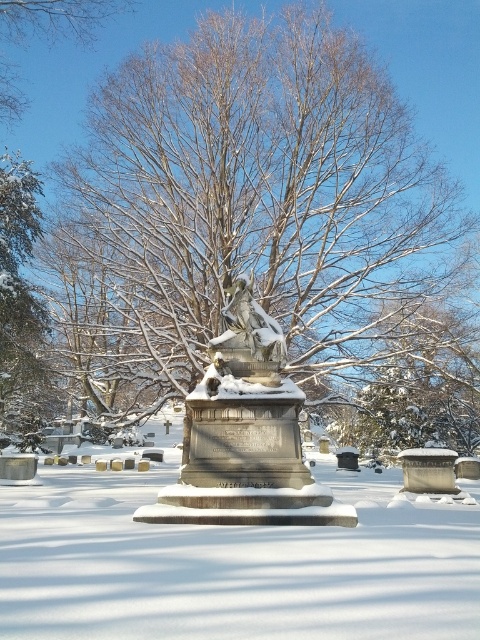
Question: Which object appears farthest from the camera in this image?

Choices:
 (A) snow-covered branches at center
 (B) bare branches at upper center
 (C) sculpted stone angel at center
 (D) white powdery snow at center

Answer: (B)

Question: Can you confirm if snow-covered branches at center is positioned to the left of green textured evergreen tree at left?

Choices:
 (A) yes
 (B) no

Answer: (B)

Question: Is white powdery snow at center in front of green textured evergreen tree at left?

Choices:
 (A) no
 (B) yes

Answer: (B)

Question: Which of the following is the closest to the observer?

Choices:
 (A) bare branches at upper center
 (B) sculpted stone angel at center
 (C) white powdery snow at center
 (D) green textured evergreen tree at left

Answer: (C)

Question: Which of the following is the closest to the observer?

Choices:
 (A) green textured evergreen tree at left
 (B) bare branches at upper center
 (C) sculpted stone angel at center
 (D) snow-covered branches at center

Answer: (C)

Question: Where is bare branches at upper center located in relation to sculpted stone angel at center in the image?

Choices:
 (A) above
 (B) below

Answer: (A)